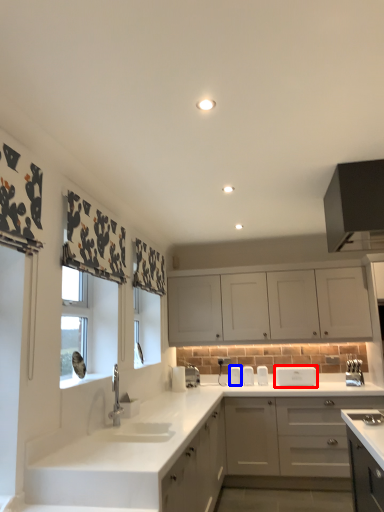
Question: Which point is further to the camera, appliance (highlighted by a red box) or appliance (highlighted by a blue box)?

Choices:
 (A) appliance
 (B) appliance

Answer: (B)